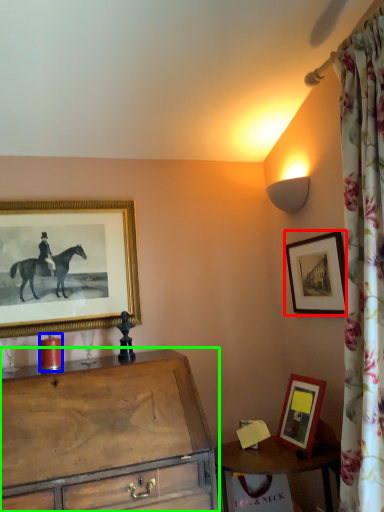
Question: Which object is the farthest from picture frame (highlighted by a red box)? Choose among these: candle holder (highlighted by a blue box) or chest of drawers (highlighted by a green box).

Choices:
 (A) candle holder
 (B) chest of drawers

Answer: (A)